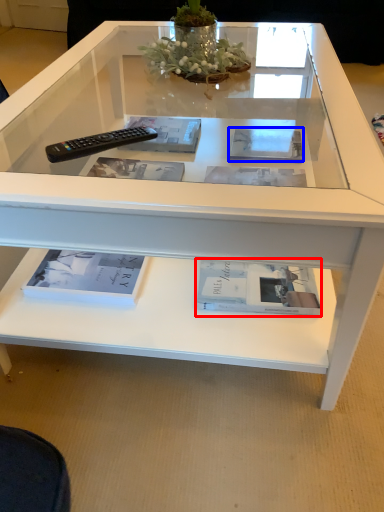
Question: Which point is closer to the camera, book (highlighted by a red box) or magazine (highlighted by a blue box)?

Choices:
 (A) book
 (B) magazine

Answer: (A)